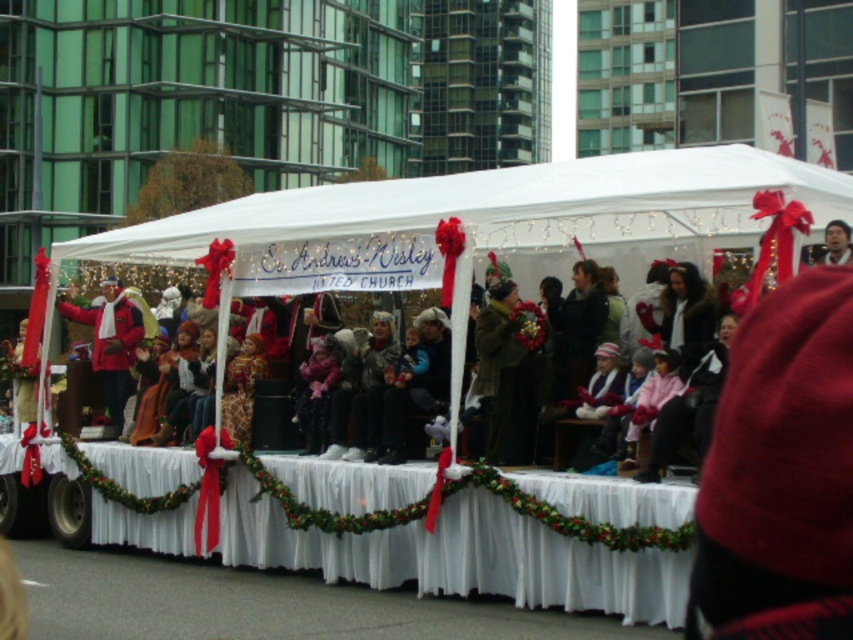
Question: Does red wool coat at left have a smaller size compared to smooth brown hair at upper right?

Choices:
 (A) no
 (B) yes

Answer: (A)

Question: Can you confirm if red wool coat at left is smaller than smooth brown hair at upper right?

Choices:
 (A) yes
 (B) no

Answer: (B)

Question: Which object appears closest to the camera in this image?

Choices:
 (A) red wool coat at left
 (B) smooth brown hair at upper right

Answer: (B)

Question: Does red wool coat at left lie behind smooth brown hair at upper right?

Choices:
 (A) no
 (B) yes

Answer: (B)